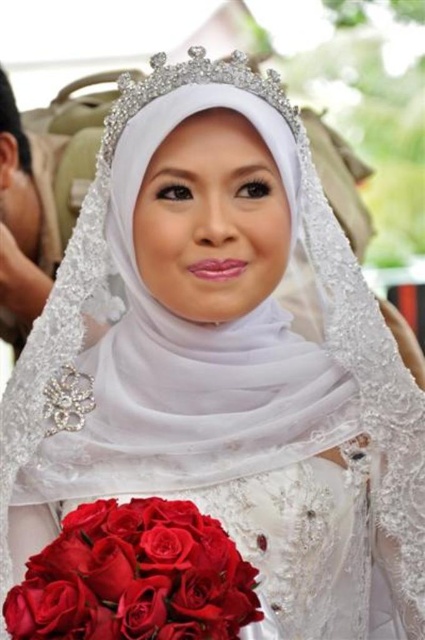
Does shiny silk bouquet at lower left come in front of clear crystal tiara at upper center?

Yes.

Which of these two, shiny silk bouquet at lower left or clear crystal tiara at upper center, stands shorter?

Standing shorter between the two is shiny silk bouquet at lower left.

Where is `shiny silk bouquet at lower left`? shiny silk bouquet at lower left is located at coordinates (x=135, y=577).

Where is `shiny silk bouquet at lower left`? shiny silk bouquet at lower left is located at coordinates (135, 577).